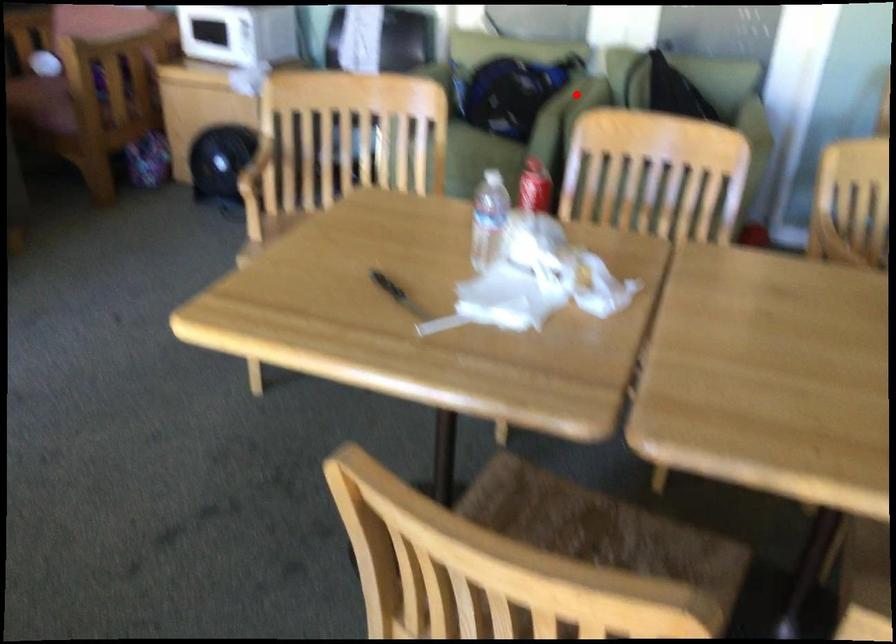
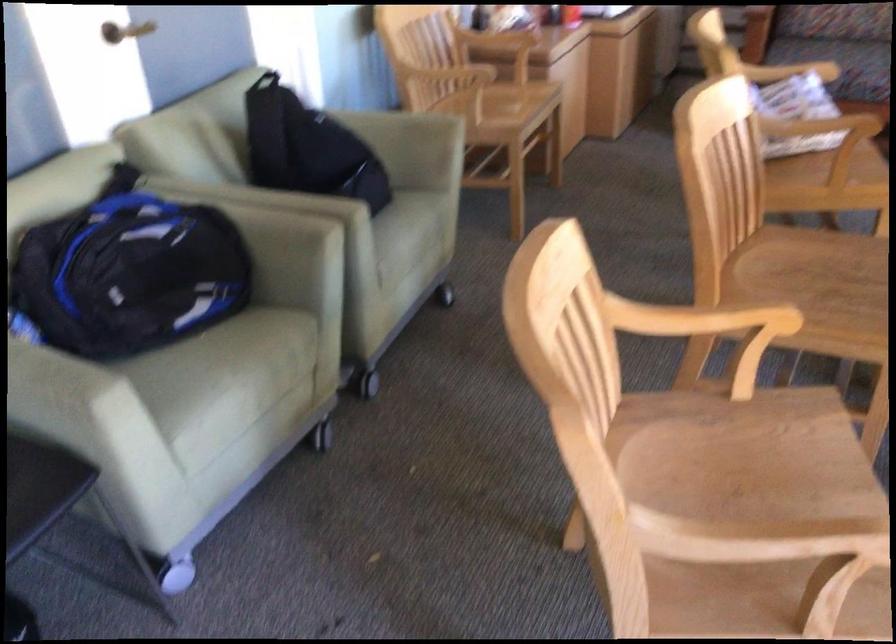
Find the pixel in the second image that matches the highlighted location in the first image.

(250, 194)